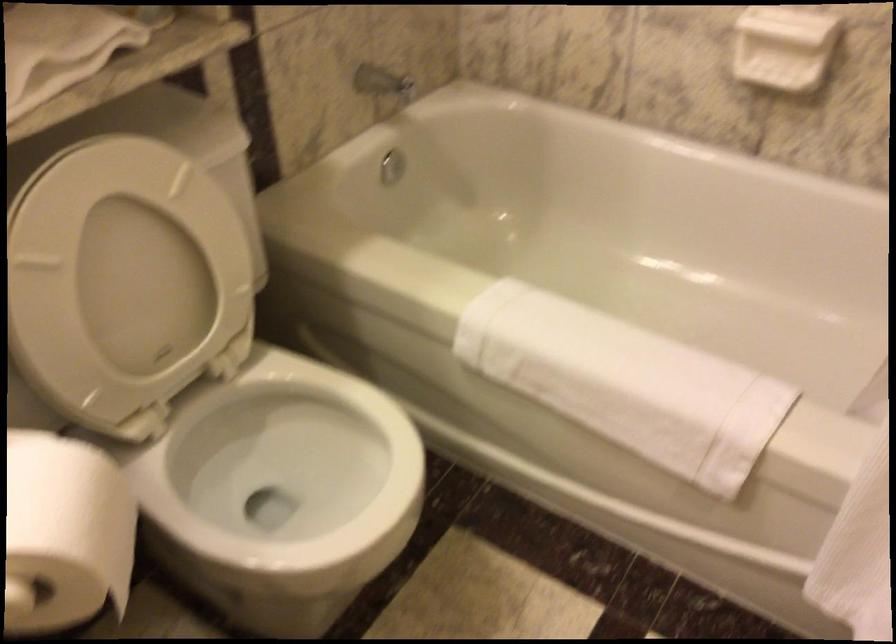
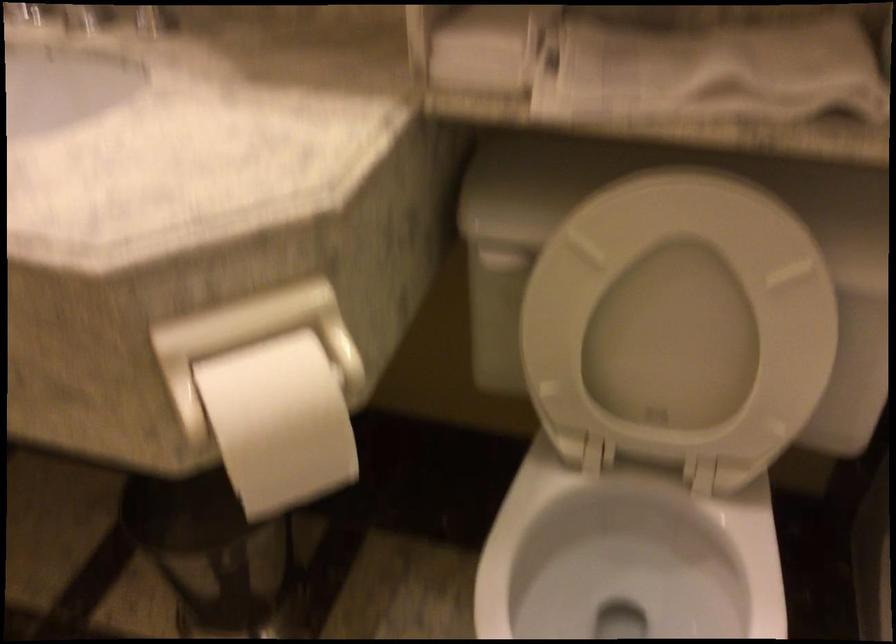
Find the pixel in the second image that matches (82,527) in the first image.

(279, 422)